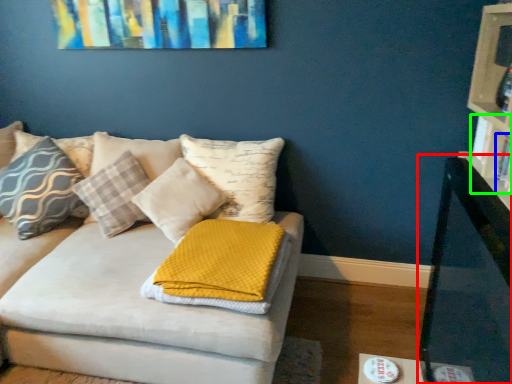
Question: Based on their relative distances, which object is nearer to table (highlighted by a red box)? Choose from book (highlighted by a blue box) and book (highlighted by a green box).

Choices:
 (A) book
 (B) book

Answer: (B)